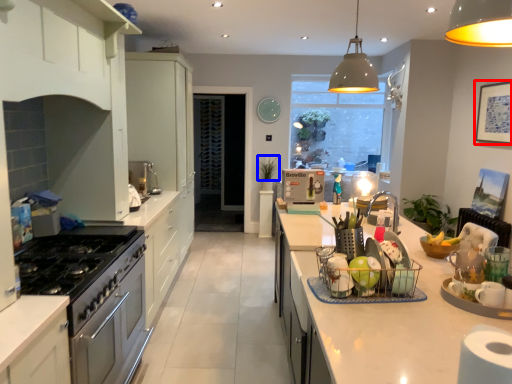
Question: Which point is closer to the camera, picture frame (highlighted by a red box) or plant (highlighted by a blue box)?

Choices:
 (A) picture frame
 (B) plant

Answer: (A)